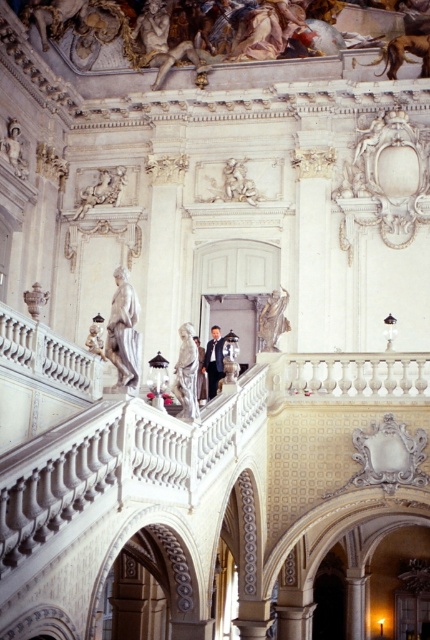
You are standing at the base of the grand staircase in the opulent interior. You notice two points marked on the railing. One is at coordinate point (5, 152) and the other at point (40, 289). If you were to walk towards the staircase landing, which point would you encounter first?

Point (40, 289) would be encountered first because it is in front of point (5, 152) according to their spatial arrangement.

In the scene shown: You are standing at the base of the grand staircase in the image. You notice a point marked at coordinates (x=187, y=374). Based on the scene description, can you identify what object this point is located on?

The point at coordinates (x=187, y=374) is located on the white marble statue at upper center.

You are an interior designer planning to place a new decorative item between the white marble statue at upper center and the matte white statue at upper left. Based on their widths, which statue should you consider for spacing adjustments to ensure the new item fits properly?

The white marble statue at upper center might be wider than the matte white statue at upper left, so you should consider adjusting the spacing near the wider statue to accommodate the new decorative item appropriately.